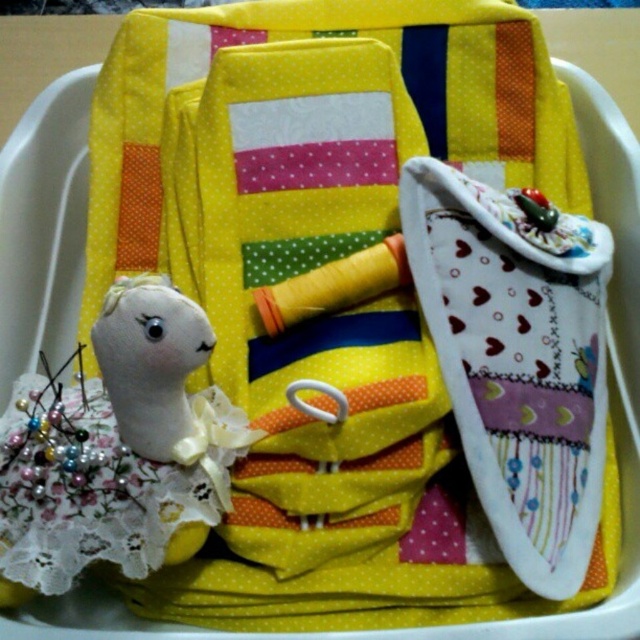
You are organizing a sewing kit and notice two dolls inside the container. The dolls are labeled as the white lace doll at lower left and the white fabric doll at lower left. Which doll is taller?

The white lace doll at lower left is much taller than the white fabric doll at lower left.

Please provide the exact 2D coordinates of the white lace doll at lower left in the image coordinate system where the origin is at the bottom left corner of the image, with the x and y axes increasing to the right and up respectively.

The exact 2D coordinates of the white lace doll at lower left are at point 0.697 in the x direction and 0.183 in the y direction.